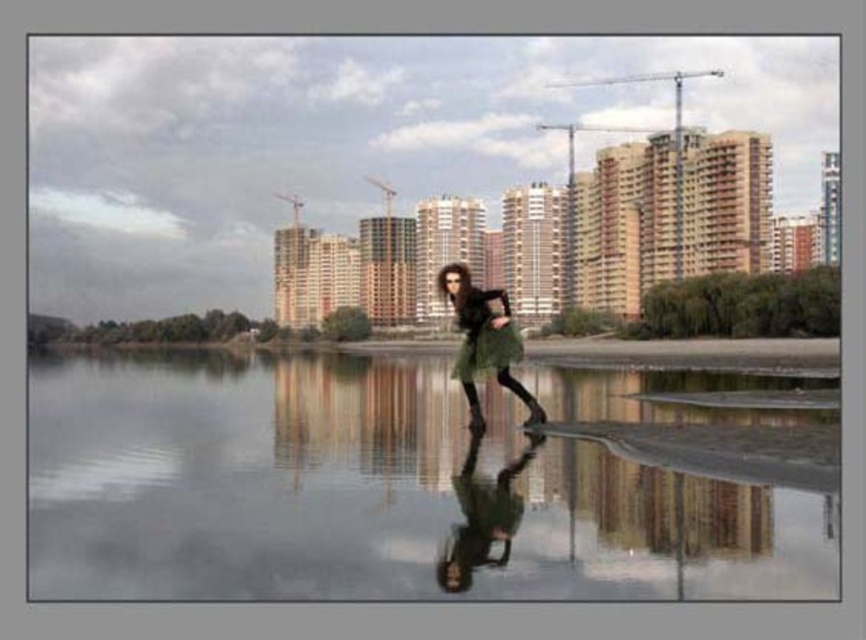
Is green fabric dress at center to the right of green matte skirt at center from the viewer's perspective?

Incorrect, green fabric dress at center is not on the right side of green matte skirt at center.

Who is lower down, green fabric dress at center or green matte skirt at center?

green fabric dress at center is below.

At what (x,y) coordinates should I click in order to perform the action: click on green fabric dress at center. Please return your answer as a coordinate pair (x, y). This screenshot has width=866, height=640. Looking at the image, I should click on (482, 516).

Which is more to the right, green matte skirt at center or green fuzzy coat at center?

From the viewer's perspective, green fuzzy coat at center appears more on the right side.

Does point (482, 294) come farther from viewer compared to point (501, 292)?

No, it is not.

Where is `green matte skirt at center`? green matte skirt at center is located at coordinates (483, 340).

Is green reflective water at center thinner than green fuzzy coat at center?

No.

Does point (578, 472) lie in front of point (482, 348)?

Yes, point (578, 472) is in front of point (482, 348).

Locate an element on the screen. This screenshot has width=866, height=640. green reflective water at center is located at coordinates (372, 492).